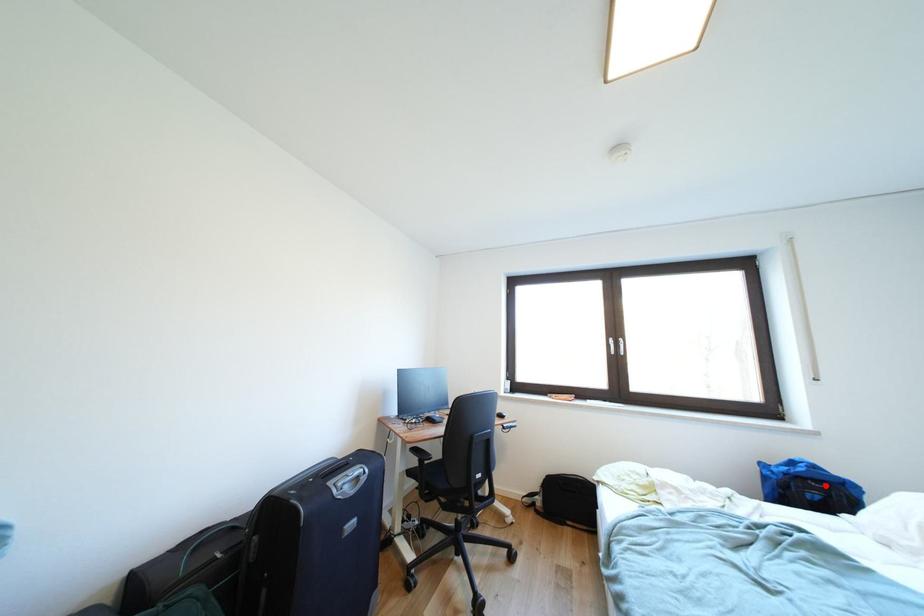
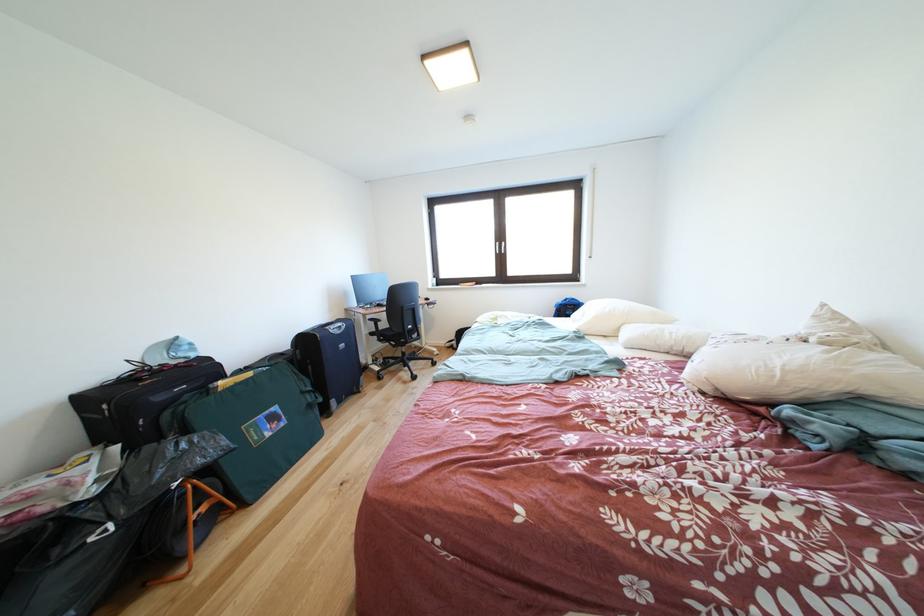
Find the pixel in the second image that matches the highlighted location in the first image.

(578, 310)